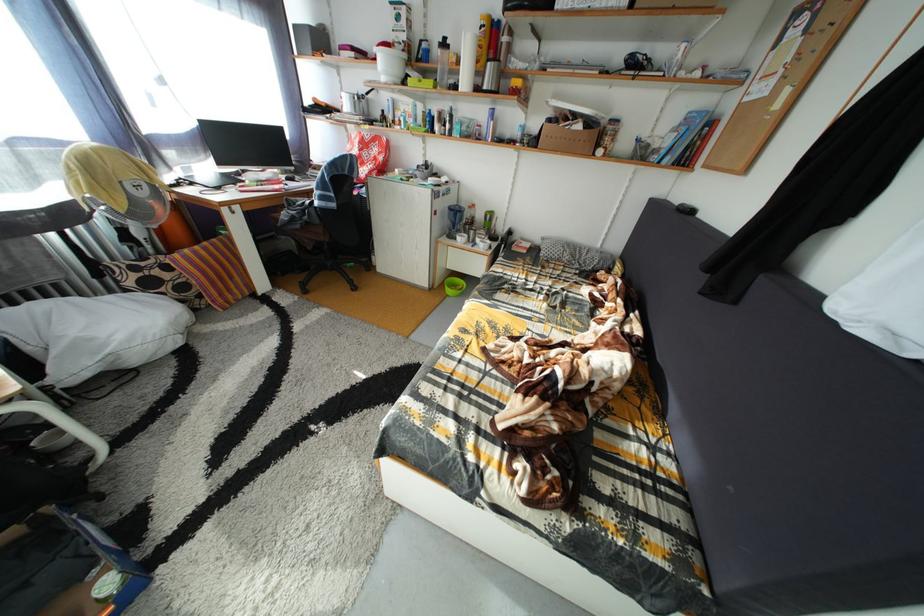
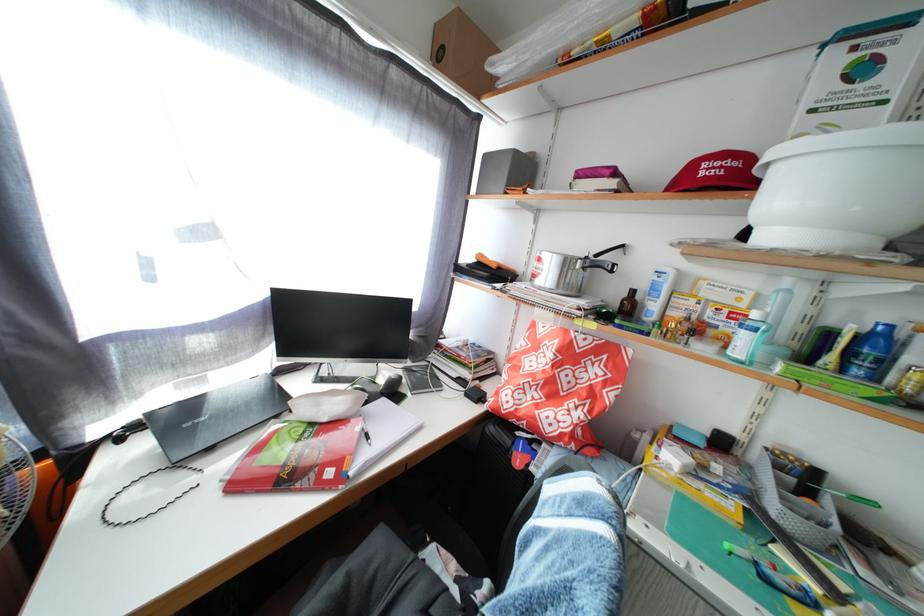
Where in the second image is the point corresponding to (375,100) from the first image?

(605, 262)